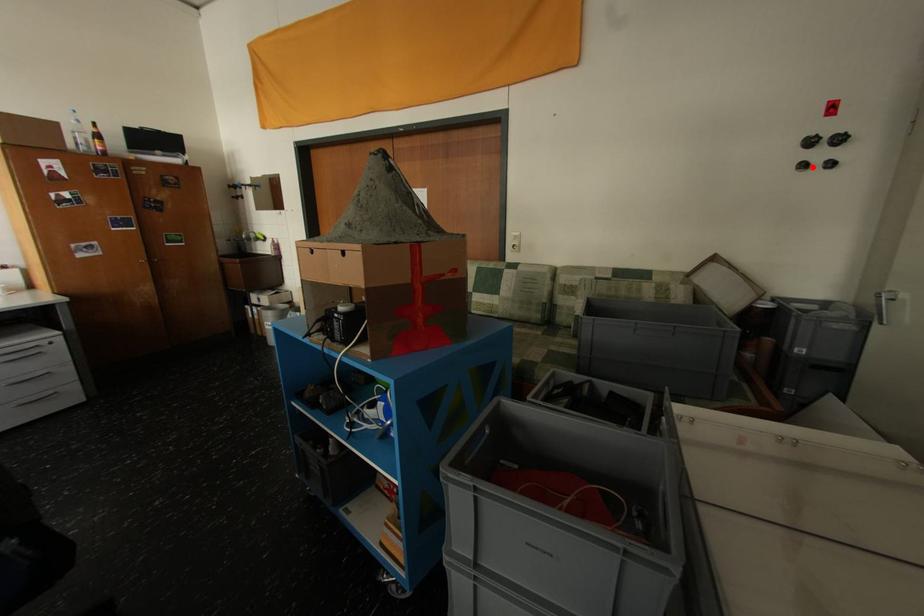
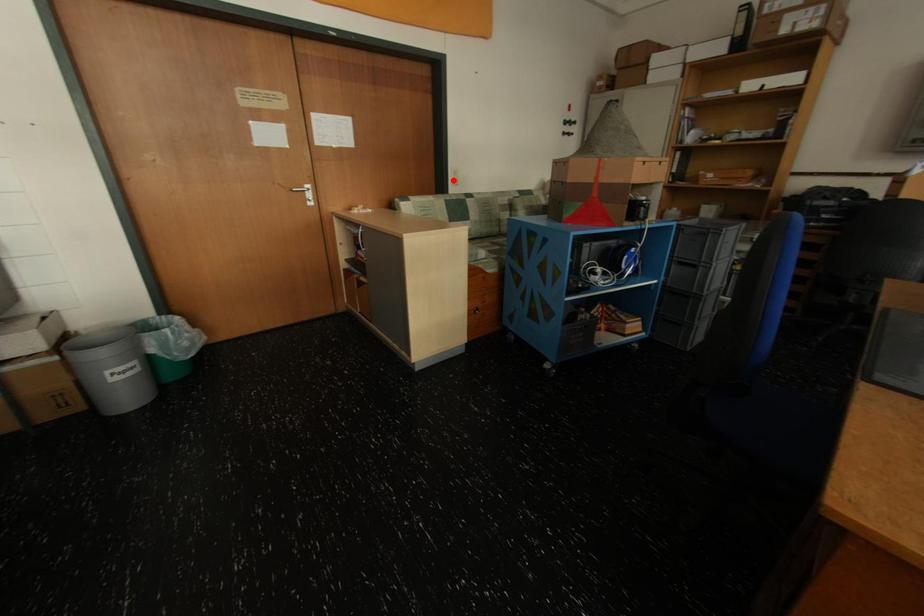
I am providing you with two images of the same scene from different viewpoints. A red point is marked on the first image and another point is marked on the second image. Does the point marked in image1 correspond to the same location as the one in image2?

No